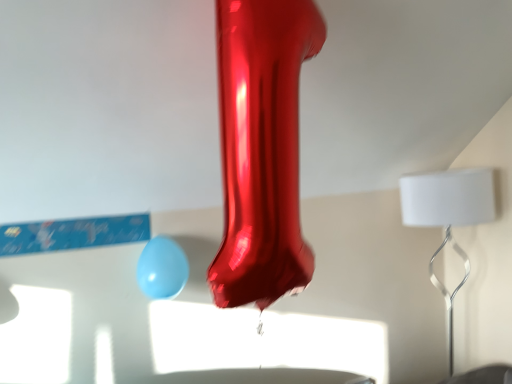
Measure the distance between white matte lampshade at right and camera.

The depth of white matte lampshade at right is 5.94 feet.

Find the location of a particular element. The width and height of the screenshot is (512, 384). white matte lampshade at right is located at coordinates (449, 217).

Measure the distance between point (481, 182) and camera.

The depth of point (481, 182) is 5.97 feet.

What do you see at coordinates (449, 217) in the screenshot? The height and width of the screenshot is (384, 512). I see `white matte lampshade at right` at bounding box center [449, 217].

What do you see at coordinates (162, 269) in the screenshot?
I see `matte blue balloon at lower center` at bounding box center [162, 269].

Image resolution: width=512 pixels, height=384 pixels. What are the coordinates of `matte blue balloon at lower center` in the screenshot? It's located at (162, 269).

Image resolution: width=512 pixels, height=384 pixels. Identify the location of white matte lampshade at right. (449, 217).

Between white matte lampshade at right and matte blue balloon at lower center, which one appears on the left side from the viewer's perspective?

From the viewer's perspective, matte blue balloon at lower center appears more on the left side.

Is white matte lampshade at right positioned in front of matte blue balloon at lower center?

No, it is not.

Which is in front, point (433, 261) or point (188, 275)?

The point (188, 275) is more forward.

From the image's perspective, which is below, white matte lampshade at right or matte blue balloon at lower center?

white matte lampshade at right is shown below in the image.

Based on the photo, from a real-world perspective, is white matte lampshade at right located beneath matte blue balloon at lower center?

Yes, from a real-world perspective, white matte lampshade at right is below matte blue balloon at lower center.

Considering the relative sizes of white matte lampshade at right and matte blue balloon at lower center in the image provided, is white matte lampshade at right wider than matte blue balloon at lower center?

Indeed, white matte lampshade at right has a greater width compared to matte blue balloon at lower center.

From their relative heights in the image, would you say white matte lampshade at right is taller or shorter than matte blue balloon at lower center?

Considering their sizes, white matte lampshade at right has more height than matte blue balloon at lower center.

Does white matte lampshade at right have a smaller size compared to matte blue balloon at lower center?

No, white matte lampshade at right is not smaller than matte blue balloon at lower center.

Is white matte lampshade at right located outside matte blue balloon at lower center?

white matte lampshade at right lies outside matte blue balloon at lower center's area.

Are white matte lampshade at right and matte blue balloon at lower center far apart?

Yes.

Is white matte lampshade at right positioned with its back to matte blue balloon at lower center?

white matte lampshade at right is not turned away from matte blue balloon at lower center.

How different are the orientations of white matte lampshade at right and matte blue balloon at lower center in degrees?

The facing directions of white matte lampshade at right and matte blue balloon at lower center are 1.4 degrees apart.

At what (x,y) coordinates should I click in order to perform the action: click on balloon above the white matte lampshade at right (from a real-world perspective). Please return your answer as a coordinate pair (x, y). The width and height of the screenshot is (512, 384). Looking at the image, I should click on (162, 269).

Is matte blue balloon at lower center to the right of white matte lampshade at right from the viewer's perspective?

No.

Relative to white matte lampshade at right, is matte blue balloon at lower center in front or behind?

In the image, matte blue balloon at lower center appears in front of white matte lampshade at right.

Considering the positions of point (162, 250) and point (455, 220), is point (162, 250) closer or farther from the camera than point (455, 220)?

Point (162, 250) appears to be closer to the viewer than point (455, 220).

From the image's perspective, is matte blue balloon at lower center above or below white matte lampshade at right?

matte blue balloon at lower center is above white matte lampshade at right.

From the picture: From a real-world perspective, is matte blue balloon at lower center positioned above or below white matte lampshade at right?

matte blue balloon at lower center is above white matte lampshade at right.

Is matte blue balloon at lower center wider or thinner than white matte lampshade at right?

In the image, matte blue balloon at lower center appears to be more narrow than white matte lampshade at right.

Between matte blue balloon at lower center and white matte lampshade at right, which one has less height?

matte blue balloon at lower center is shorter.

Between matte blue balloon at lower center and white matte lampshade at right, which one has larger size?

With larger size is white matte lampshade at right.

Would you say matte blue balloon at lower center is outside white matte lampshade at right?

Yes.

Is matte blue balloon at lower center positioned far away from white matte lampshade at right?

matte blue balloon at lower center is positioned a significant distance from white matte lampshade at right.

Is matte blue balloon at lower center aimed at white matte lampshade at right?

No, matte blue balloon at lower center is not oriented towards white matte lampshade at right.

How different are the orientations of matte blue balloon at lower center and white matte lampshade at right in degrees?

The angular difference between matte blue balloon at lower center and white matte lampshade at right is 1.4 degrees.

This screenshot has height=384, width=512. I want to click on balloon above the white matte lampshade at right (from a real-world perspective), so click(x=162, y=269).

Where is `lamp that appears behind the matte blue balloon at lower center`? The height and width of the screenshot is (384, 512). lamp that appears behind the matte blue balloon at lower center is located at coordinates (449, 217).

Find the location of `balloon in front of the white matte lampshade at right`. balloon in front of the white matte lampshade at right is located at coordinates (162, 269).